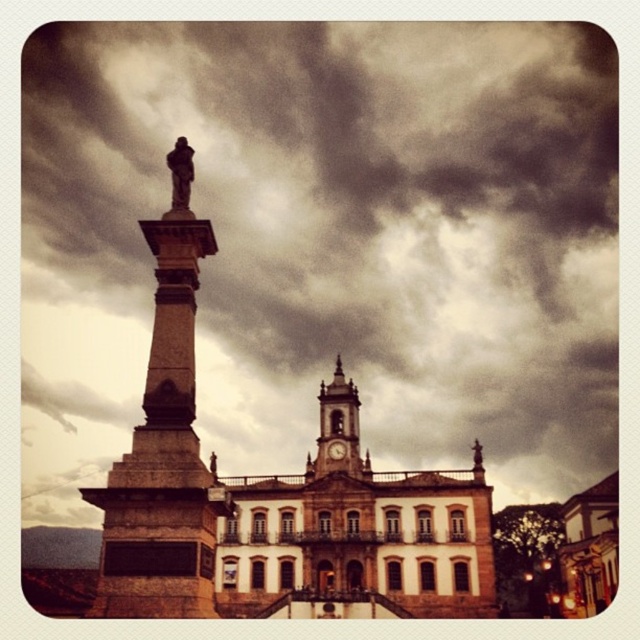
Question: Can you confirm if cloudy sky at upper center is positioned to the right of golden stone clock tower at center?

Choices:
 (A) no
 (B) yes

Answer: (A)

Question: Can you confirm if cloudy sky at upper center is wider than metallic clock at center?

Choices:
 (A) no
 (B) yes

Answer: (B)

Question: Estimate the real-world distances between objects in this image. Which object is farther from the golden stone clock tower at center?

Choices:
 (A) metallic clock at center
 (B) cloudy sky at upper center
 (C) brown stone obelisk at left
 (D) bronze statue at center

Answer: (C)

Question: Which object appears closest to the camera in this image?

Choices:
 (A) golden stone clock tower at center
 (B) cloudy sky at upper center
 (C) metallic clock at center
 (D) bronze statue at center

Answer: (D)

Question: Which is farther from the brown stone obelisk at left?

Choices:
 (A) cloudy sky at upper center
 (B) bronze statue at center
 (C) golden stone clock tower at center

Answer: (A)

Question: Is golden stone clock tower at center closer to camera compared to metallic clock at center?

Choices:
 (A) yes
 (B) no

Answer: (A)